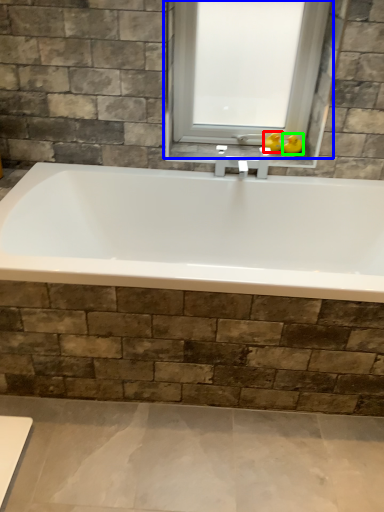
Question: Considering the real-world distances, which object is closest to duck (highlighted by a red box)? window (highlighted by a blue box) or duck (highlighted by a green box).

Choices:
 (A) window
 (B) duck

Answer: (B)